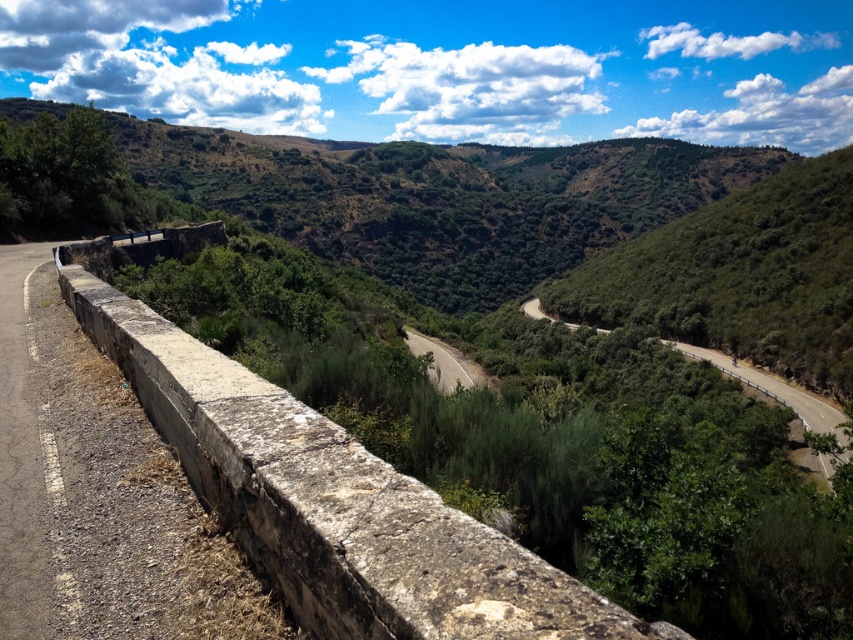
Does green leafy mountain at upper center have a lesser height compared to gray asphalt road at center?

No, green leafy mountain at upper center is not shorter than gray asphalt road at center.

This screenshot has width=853, height=640. Describe the element at coordinates (442, 198) in the screenshot. I see `green leafy mountain at upper center` at that location.

Find the location of a particular element. green leafy mountain at upper center is located at coordinates (442, 198).

Which of these two, rusty concrete ledge at left or asphalt road at center, stands taller?

asphalt road at center is taller.

Which of these two, rusty concrete ledge at left or asphalt road at center, stands shorter?

Standing shorter between the two is rusty concrete ledge at left.

Measure the distance between point (473, 531) and camera.

Point (473, 531) is 3.37 meters from camera.

Where is `rusty concrete ledge at left`? rusty concrete ledge at left is located at coordinates (328, 497).

Is point (698, 22) farther from viewer compared to point (318, 184)?

Yes, it is behind point (318, 184).

Locate an element on the screen. This screenshot has height=640, width=853. green grassy hill at upper center is located at coordinates 448,67.